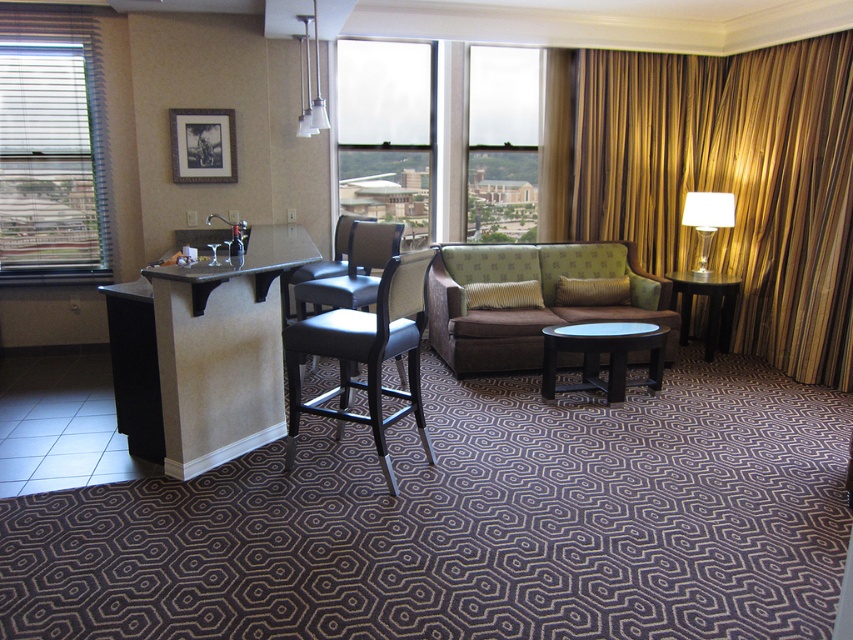
Question: Is wooden blinds at left thinner than blue glass table at center?

Choices:
 (A) no
 (B) yes

Answer: (A)

Question: Which point appears closest to the camera in this image?

Choices:
 (A) (283, 339)
 (B) (677, 317)

Answer: (A)

Question: Can you confirm if gold striped curtain at right is wider than black leather chair at center?

Choices:
 (A) no
 (B) yes

Answer: (B)

Question: Which object appears closest to the camera in this image?

Choices:
 (A) black leather chair at center
 (B) black wood side table at right

Answer: (A)

Question: Considering the relative positions of gold striped curtain at right and white glass lamp at right in the image provided, where is gold striped curtain at right located with respect to white glass lamp at right?

Choices:
 (A) left
 (B) right

Answer: (B)

Question: Which of the following is the farthest from the observer?

Choices:
 (A) (418, 147)
 (B) (525, 115)
 (C) (502, 320)

Answer: (B)